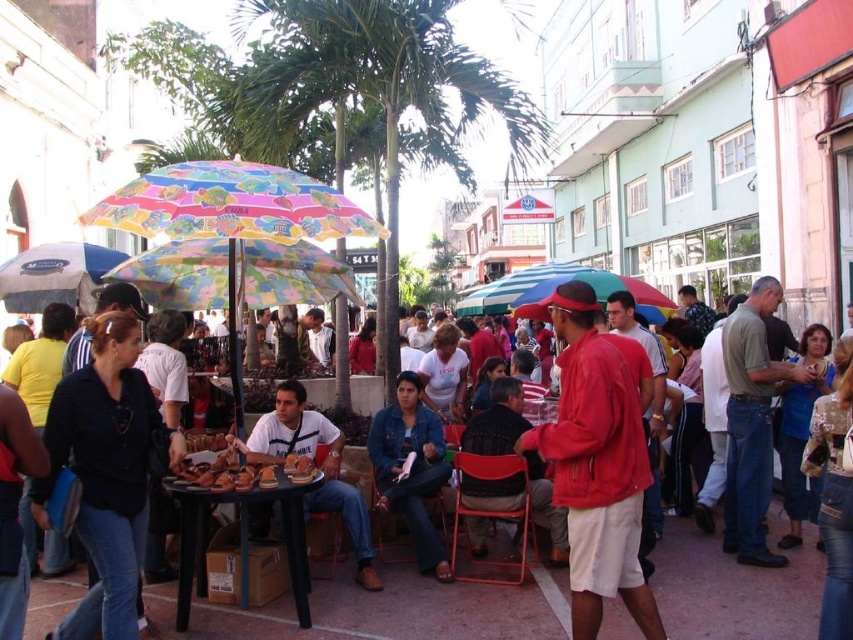
You are standing at the market and want to take a photo of both the point at coordinates point (584,371) and point (361,520). Since you want both points to be in focus, you need to know which one is closer to you. Can you tell me which point is closer?

Point (584,371) is closer to the viewer than point (361,520), so you should focus on that point to ensure both are in focus.

Consider the image. You are a customer at the market and want to buy a jacket and a shirt. You notice the red matte jacket at center and the white cotton shirt at center. Which item would you need to reach for first if they are both hanging on the same rack and the jacket is above the shirt?

The red matte jacket at center is larger in size than the white cotton shirt at center, so it might be placed higher on the rack. To reach the jacket first, you would need to reach upwards to get it before the shirt below.